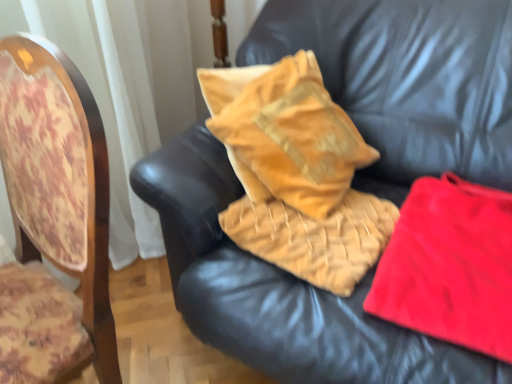
Question: Is velvet/yellow pillow at center oriented away from red fleece blanket at right, the 1th material viewed from the right?

Choices:
 (A) no
 (B) yes

Answer: (A)

Question: Can you confirm if velvet/yellow pillow at center is positioned to the right of red fleece blanket at right, the 1th material viewed from the right?

Choices:
 (A) no
 (B) yes

Answer: (A)

Question: From the image's perspective, is velvet/yellow pillow at center on red fleece blanket at right, the 1th material viewed from the right?

Choices:
 (A) yes
 (B) no

Answer: (A)

Question: Does velvet/yellow pillow at center come in front of red fleece blanket at right, which is the 2th material from left to right?

Choices:
 (A) no
 (B) yes

Answer: (A)

Question: Is velvet/yellow pillow at center thinner than red fleece blanket at right, which is the 2th material from left to right?

Choices:
 (A) no
 (B) yes

Answer: (B)

Question: Would you say velvet/yellow pillow at center is to the left or to the right of wooden chair back at left in the picture?

Choices:
 (A) right
 (B) left

Answer: (A)

Question: Considering their positions, is velvet/yellow pillow at center located in front of or behind wooden chair back at left?

Choices:
 (A) front
 (B) behind

Answer: (B)

Question: In terms of size, does velvet/yellow pillow at center appear bigger or smaller than wooden chair back at left?

Choices:
 (A) small
 (B) big

Answer: (A)

Question: Is velvet/yellow pillow at center inside or outside of wooden chair back at left?

Choices:
 (A) inside
 (B) outside

Answer: (B)

Question: Considering the positions of velvet gold pillow at center, placed as the first material when sorted from left to right, and wooden chair back at left in the image, is velvet gold pillow at center, placed as the first material when sorted from left to right, bigger or smaller than wooden chair back at left?

Choices:
 (A) big
 (B) small

Answer: (B)

Question: Considering the positions of point (231, 226) and point (58, 289), is point (231, 226) closer or farther from the camera than point (58, 289)?

Choices:
 (A) closer
 (B) farther

Answer: (B)

Question: From the image's perspective, is velvet gold pillow at center, placed as the first material when sorted from left to right, positioned above or below wooden chair back at left?

Choices:
 (A) above
 (B) below

Answer: (A)

Question: Considering the relative positions of velvet gold pillow at center, the second material when ordered from right to left, and wooden chair back at left in the image provided, is velvet gold pillow at center, the second material when ordered from right to left, to the left or to the right of wooden chair back at left?

Choices:
 (A) left
 (B) right

Answer: (B)

Question: Looking at their shapes, would you say velvet orange pillow at upper center is wider or thinner than velvet gold pillow at center, the second material when ordered from right to left?

Choices:
 (A) wide
 (B) thin

Answer: (A)

Question: In terms of height, does velvet orange pillow at upper center look taller or shorter compared to velvet gold pillow at center, the second material when ordered from right to left?

Choices:
 (A) tall
 (B) short

Answer: (A)